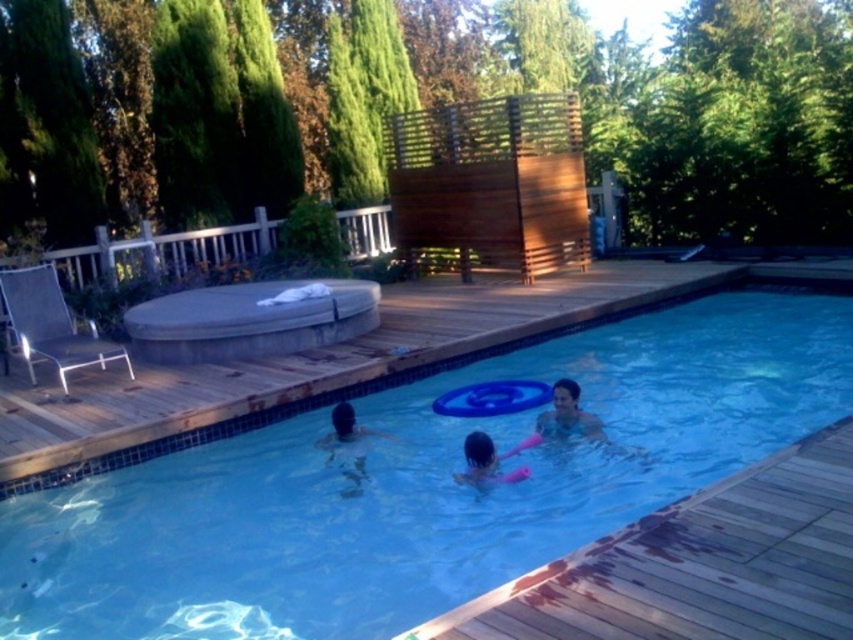
Question: Does blue glossy water at center lie behind wooden deck at center?

Choices:
 (A) yes
 (B) no

Answer: (B)

Question: Considering the relative positions of blue glossy water at center and smooth skin at center in the image provided, where is blue glossy water at center located with respect to smooth skin at center?

Choices:
 (A) above
 (B) below

Answer: (B)

Question: Which object appears closest to the camera in this image?

Choices:
 (A) pink rubber at center
 (B) blue glossy water at center

Answer: (B)

Question: Can you confirm if wooden deck at lower right is thinner than smooth skin at center?

Choices:
 (A) no
 (B) yes

Answer: (A)

Question: Based on their relative distances, which object is nearer to the white concrete hot tub at upper left?

Choices:
 (A) wooden deck at lower right
 (B) blue glossy water at center
 (C) pink rubber at center

Answer: (B)

Question: Which point is farther from the camera taking this photo?

Choices:
 (A) (306, 308)
 (B) (598, 438)

Answer: (A)